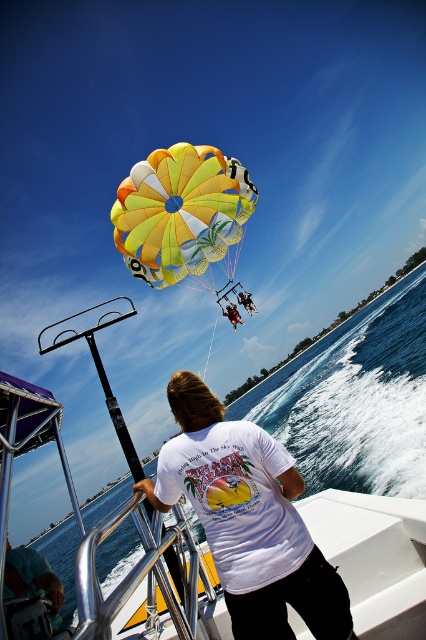
Is white cotton t-shirt at center behind yellow fabric parachute at upper center?

No, white cotton t-shirt at center is in front of yellow fabric parachute at upper center.

Can you confirm if white cotton t-shirt at center is bigger than yellow fabric parachute at upper center?

No.

Find the location of a particular element. The height and width of the screenshot is (640, 426). white cotton t-shirt at center is located at coordinates (247, 518).

Is yellow fabric parachute at upper center thinner than white t-shirt at center?

No.

Between yellow fabric parachute at upper center and white t-shirt at center, which one is positioned lower?

white t-shirt at center is lower down.

Does point (187, 164) come in front of point (235, 332)?

Yes, it is.

Identify the location of yellow fabric parachute at upper center. The height and width of the screenshot is (640, 426). (181, 211).

Does white cotton t-shirt at center have a lesser height compared to white t-shirt at center?

Incorrect, white cotton t-shirt at center's height does not fall short of white t-shirt at center's.

How distant is white cotton t-shirt at center from white t-shirt at center?

white cotton t-shirt at center and white t-shirt at center are 11.28 meters apart from each other.

Does point (307, 570) come farther from viewer compared to point (236, 314)?

No.

The image size is (426, 640). In order to click on white cotton t-shirt at center in this screenshot , I will do `click(247, 518)`.